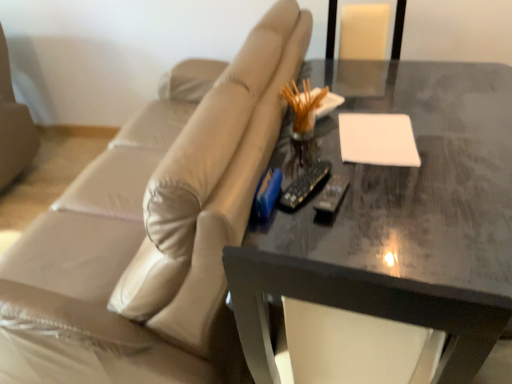
Find the location of a particular element. vacant area that is in front of white matte notepad at upper right is located at coordinates (411, 187).